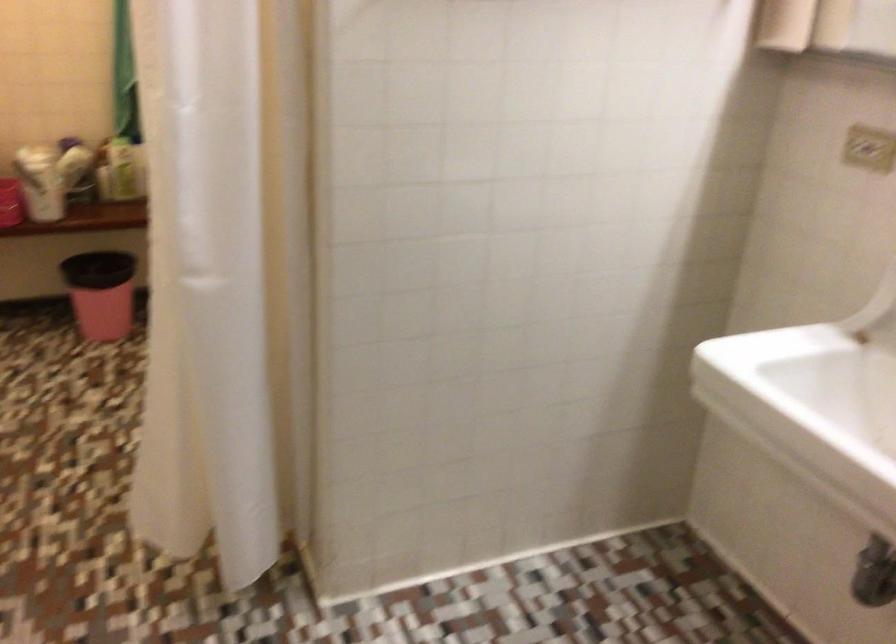
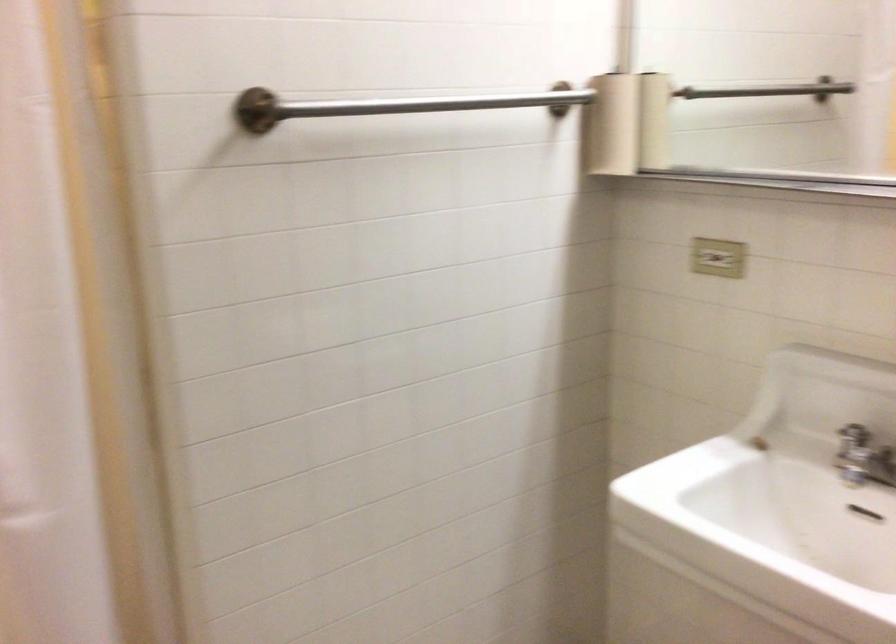
Which direction would the cameraman need to move to produce the second image?

The movement direction of the cameraman is left, forward.